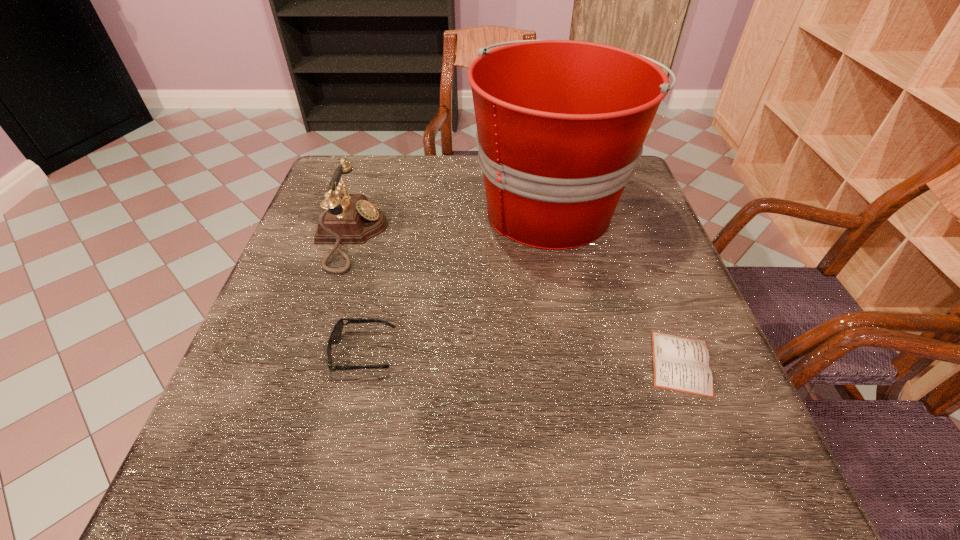
Locate an element on the screen. The image size is (960, 540). the tallest object is located at coordinates (561, 124).

This screenshot has width=960, height=540. I want to click on telephone, so click(347, 218).

I want to click on sunglasses, so 336,333.

Where is `diary`? This screenshot has height=540, width=960. diary is located at coordinates (681, 364).

Where is `vacant space situated on the left of the tallest object`? The image size is (960, 540). vacant space situated on the left of the tallest object is located at coordinates 446,207.

Locate an element on the screen. The width and height of the screenshot is (960, 540). vacant space located 0.400m on the dial of the telephone is located at coordinates (552, 237).

This screenshot has height=540, width=960. What are the coordinates of `vacant space located on the front-facing side of the second shortest object` in the screenshot? It's located at (517, 352).

Where is `vacant region located on the left of the shortest object`? vacant region located on the left of the shortest object is located at coordinates (483, 363).

You are a GUI agent. You are given a task and a screenshot of the screen. Output one action in this format:
    pyautogui.click(x=<x>, y=<y>)
    Task: Click on the object located at the far edge
    This screenshot has height=540, width=960.
    Given the screenshot: What is the action you would take?
    point(561,124)

The width and height of the screenshot is (960, 540). In order to click on object located at the left edge in this screenshot , I will do `click(347, 218)`.